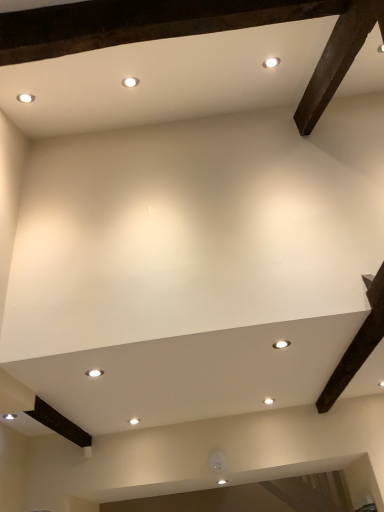
Question: Visually, is white glossy light fixture at center, arranged as the first lighting when viewed from the left, positioned to the left or to the right of white glossy light fixture at center, the 1th lighting viewed from the right?

Choices:
 (A) left
 (B) right

Answer: (A)

Question: Is white glossy light fixture at center, arranged as the first lighting when viewed from the left, bigger or smaller than white glossy light fixture at center, the 1th lighting viewed from the right?

Choices:
 (A) big
 (B) small

Answer: (A)

Question: Is white glossy light fixture at center, marked as the second lighting in a top-to-bottom arrangement, situated inside white glossy light fixture at center, the second lighting positioned from the bottom, or outside?

Choices:
 (A) inside
 (B) outside

Answer: (B)

Question: Considering their positions, is white glossy light fixture at center, the second lighting positioned from the bottom, located in front of or behind white glossy light fixture at center, positioned as the 1th lighting in bottom-to-top order?

Choices:
 (A) behind
 (B) front

Answer: (B)

Question: Which is correct: white glossy light fixture at center, the second lighting positioned from the bottom, is inside white glossy light fixture at center, marked as the second lighting in a top-to-bottom arrangement, or outside of it?

Choices:
 (A) inside
 (B) outside

Answer: (B)

Question: Does point (274, 343) appear closer or farther from the camera than point (94, 369)?

Choices:
 (A) closer
 (B) farther

Answer: (A)

Question: In terms of height, does white glossy light fixture at center, the second lighting positioned from the bottom, look taller or shorter compared to white glossy light fixture at center, which is the 2th lighting in right-to-left order?

Choices:
 (A) tall
 (B) short

Answer: (B)